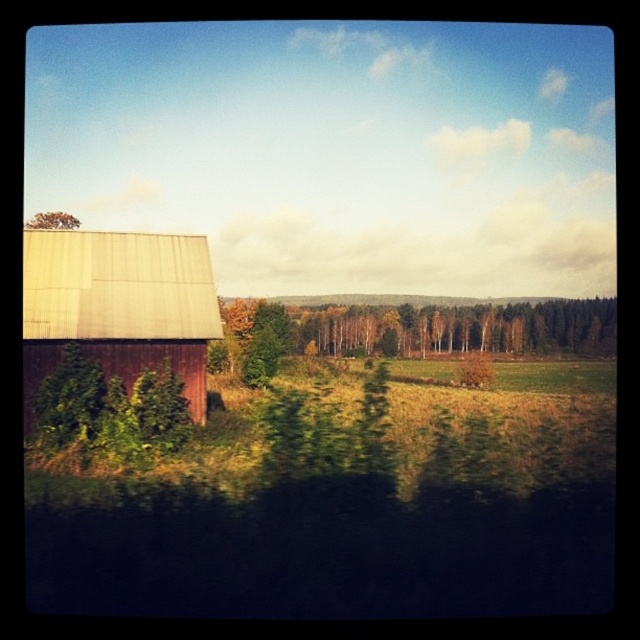
Question: Which point appears farthest from the camera in this image?

Choices:
 (A) (172, 298)
 (B) (45, 212)

Answer: (B)

Question: Does wooden barn at left have a larger size compared to brown textured tree at upper left?

Choices:
 (A) yes
 (B) no

Answer: (B)

Question: Which point is closer to the camera taking this photo?

Choices:
 (A) (33, 227)
 (B) (614, 323)
 (C) (202, 326)

Answer: (C)

Question: Is green leafy tree at center above brown textured tree at upper left?

Choices:
 (A) no
 (B) yes

Answer: (A)

Question: Is green leafy tree at center further to the viewer compared to brown textured tree at upper left?

Choices:
 (A) no
 (B) yes

Answer: (B)

Question: Which of these objects is positioned farthest from the wooden barn at left?

Choices:
 (A) green leafy tree at center
 (B) brown textured tree at upper left

Answer: (A)